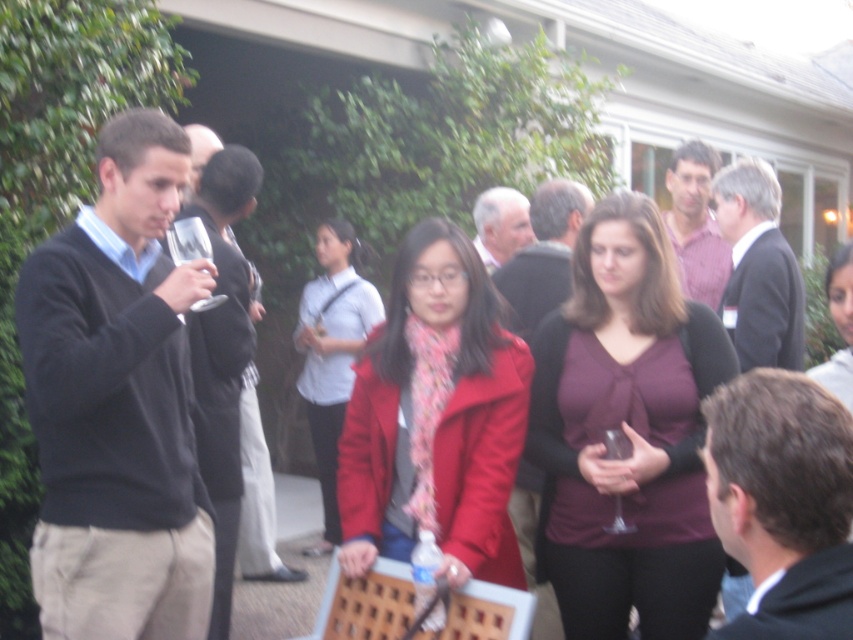
Based on the photo, does matte black sweater at left appear over dark gray suit at center?

Actually, matte black sweater at left is below dark gray suit at center.

Who is positioned more to the left, matte black sweater at left or dark gray suit at center?

matte black sweater at left

Is point (248, 336) less distant than point (750, 161)?

Yes, point (248, 336) is closer to viewer.

Find the location of a particular element. matte black sweater at left is located at coordinates (223, 356).

Is point (469, 456) in front of point (236, 388)?

Yes.

Does point (396, 276) come behind point (236, 333)?

No, (396, 276) is closer to viewer.

At what (x,y) coordinates should I click in order to perform the action: click on matte red coat at center. Please return your answer as a coordinate pair (x, y). Looking at the image, I should click on (436, 417).

The image size is (853, 640). I want to click on matte red coat at center, so click(x=436, y=417).

Is point (136, 518) positioned before point (485, 260)?

That is True.

Is point (173, 397) positioned behind point (506, 196)?

No, (173, 397) is in front of (506, 196).

Where is `dark gray sweater at left`? dark gray sweater at left is located at coordinates (117, 403).